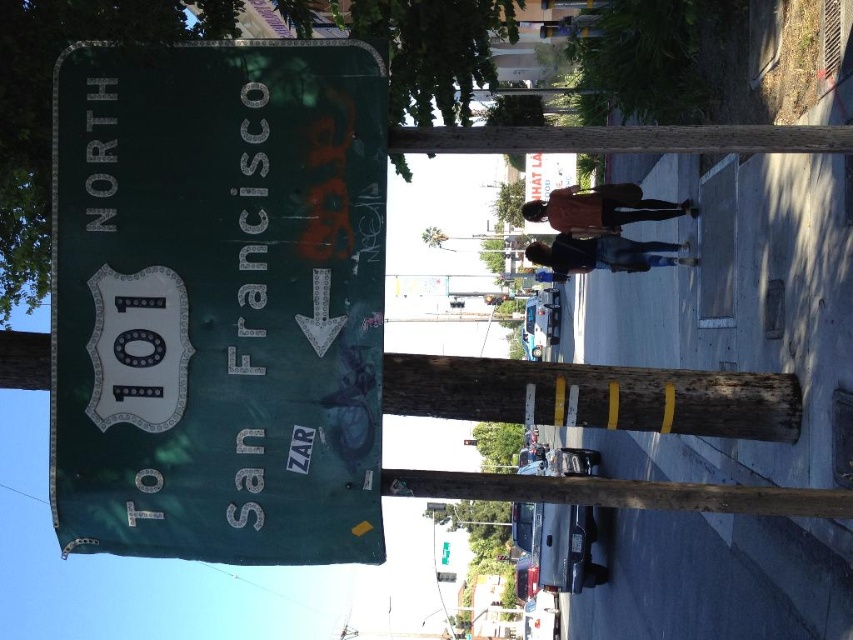
You are standing in front of the highway sign for North 101 leading to San Francisco. You notice two points marked on the sign at coordinates point (x=84, y=72) and point (x=712, y=426). Which point is closer to you?

Point (x=84, y=72) is closer to the viewer than point (x=712, y=426).

You are a photographer wanting to capture the green matte sign at left and the wooden post at center in a single frame. Based on their positions, which object should you focus on first to ensure both are in the shot?

The green matte sign at left is positioned on the left side of the wooden post at center, so you should focus on the wooden post at center first to ensure both are included in the frame.